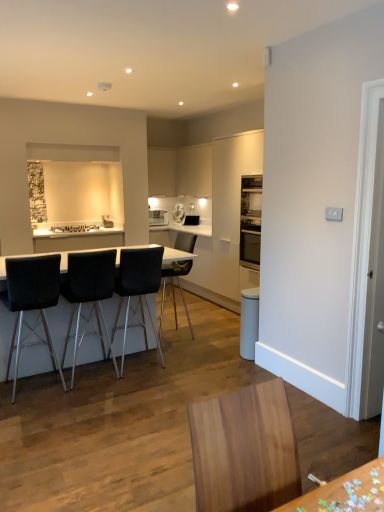
Image resolution: width=384 pixels, height=512 pixels. Find the location of `free location to the right of black leather chair at center, acting as the 2th chair starting from the left`. free location to the right of black leather chair at center, acting as the 2th chair starting from the left is located at coordinates (146, 382).